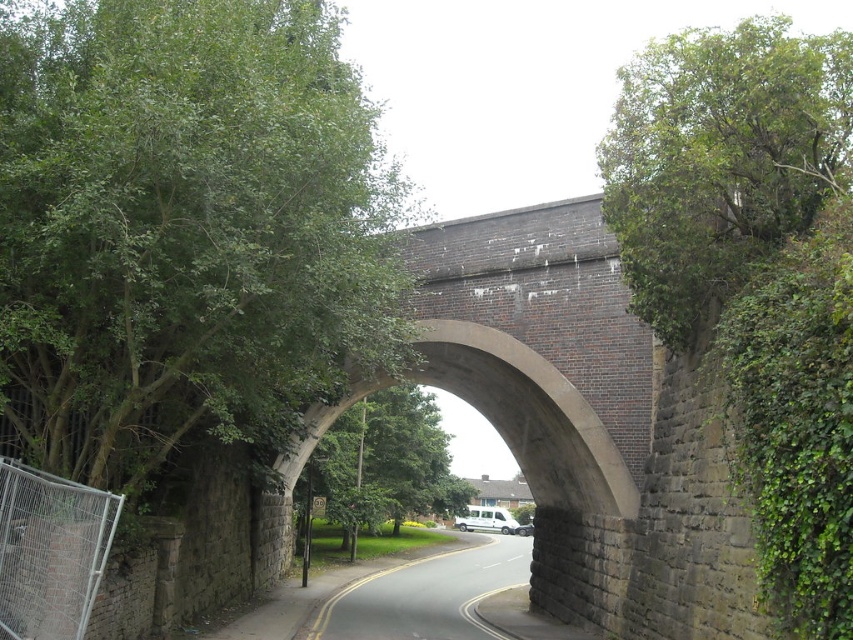
Who is more distant from viewer, (57, 250) or (779, 45)?

The point (779, 45) is more distant.

Which is more to the right, green leafy tree at upper left or green leafy tree at upper right?

green leafy tree at upper right is more to the right.

Who is more distant from viewer, (19, 422) or (793, 99)?

The point (19, 422) is behind.

Find the location of a particular element. The width and height of the screenshot is (853, 640). green leafy tree at upper left is located at coordinates (184, 227).

Does green leafy tree at upper left have a lesser width compared to green leafy tree at center?

Yes, green leafy tree at upper left is thinner than green leafy tree at center.

Measure the distance between point (119, 106) and camera.

Point (119, 106) and camera are 96.72 feet apart.

Between point (71, 468) and point (404, 484), which one is positioned in front?

Point (71, 468) is more forward.

Identify the location of green leafy tree at upper left. coord(184,227).

Who is shorter, green leafy tree at upper right or green leafy tree at center?

Standing shorter between the two is green leafy tree at center.

The image size is (853, 640). What do you see at coordinates (720, 161) in the screenshot? I see `green leafy tree at upper right` at bounding box center [720, 161].

Image resolution: width=853 pixels, height=640 pixels. In order to click on green leafy tree at upper right in this screenshot , I will do `click(720, 161)`.